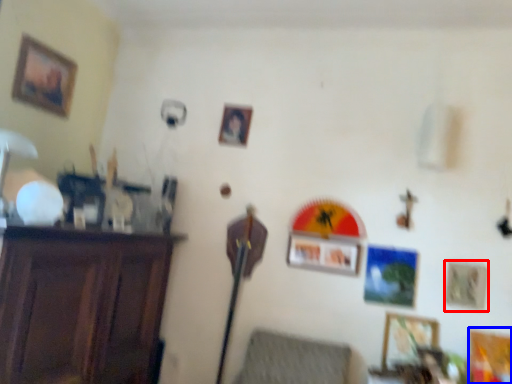
Question: Which object appears closest to the camera in this image, picture frame (highlighted by a red box) or picture frame (highlighted by a blue box)?

Choices:
 (A) picture frame
 (B) picture frame

Answer: (B)